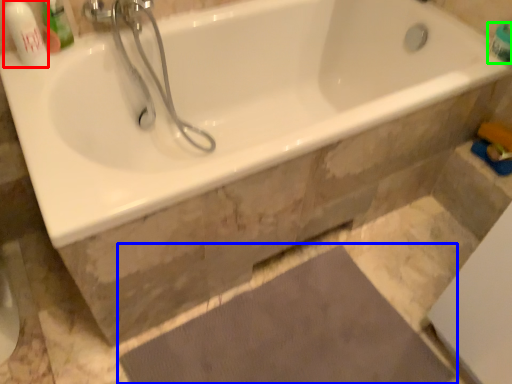
Question: Based on their relative distances, which object is nearer to toiletry (highlighted by a red box)? Choose from doormat (highlighted by a blue box) and toiletry (highlighted by a green box).

Choices:
 (A) doormat
 (B) toiletry

Answer: (A)